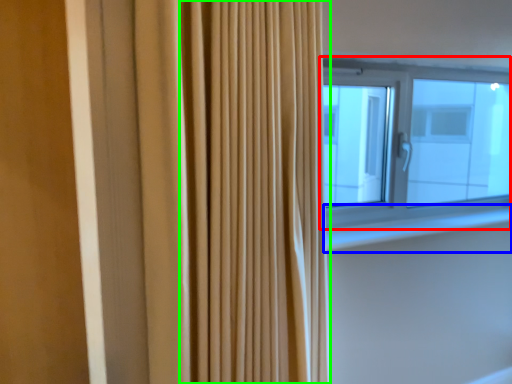
Question: Based on their relative distances, which object is farther from window (highlighted by a red box)? Choose from window sill (highlighted by a blue box) and shower curtain (highlighted by a green box).

Choices:
 (A) window sill
 (B) shower curtain

Answer: (B)